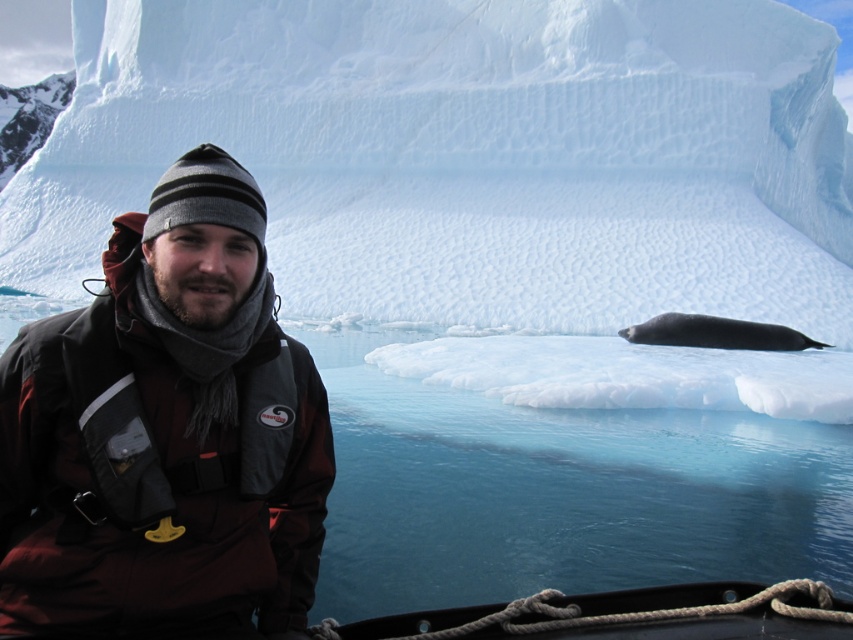
Question: Is white ice at center thinner than transparent blue water at lower center?

Choices:
 (A) yes
 (B) no

Answer: (B)

Question: Among these points, which one is nearest to the camera?

Choices:
 (A) [x=200, y=493]
 (B) [x=558, y=132]
 (C) [x=718, y=323]

Answer: (A)

Question: Can you confirm if white ice at center is positioned to the left of dark gray knit hat at upper left?

Choices:
 (A) no
 (B) yes

Answer: (B)

Question: Observing the image, what is the correct spatial positioning of white ice at center in reference to dark gray knit hat at upper left?

Choices:
 (A) right
 (B) left

Answer: (B)

Question: Which of the following is the closest to the observer?

Choices:
 (A) (498, 221)
 (B) (173, 566)

Answer: (B)

Question: Which point is farther from the camera taking this photo?

Choices:
 (A) (183, 490)
 (B) (659, 320)
 (C) (701, 292)
 (D) (602, 582)

Answer: (C)